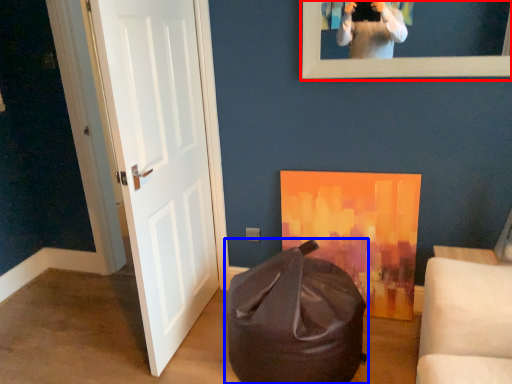
Question: Which of the following is the farthest to the observer, picture frame (highlighted by a red box) or bean bag chair (highlighted by a blue box)?

Choices:
 (A) picture frame
 (B) bean bag chair

Answer: (A)